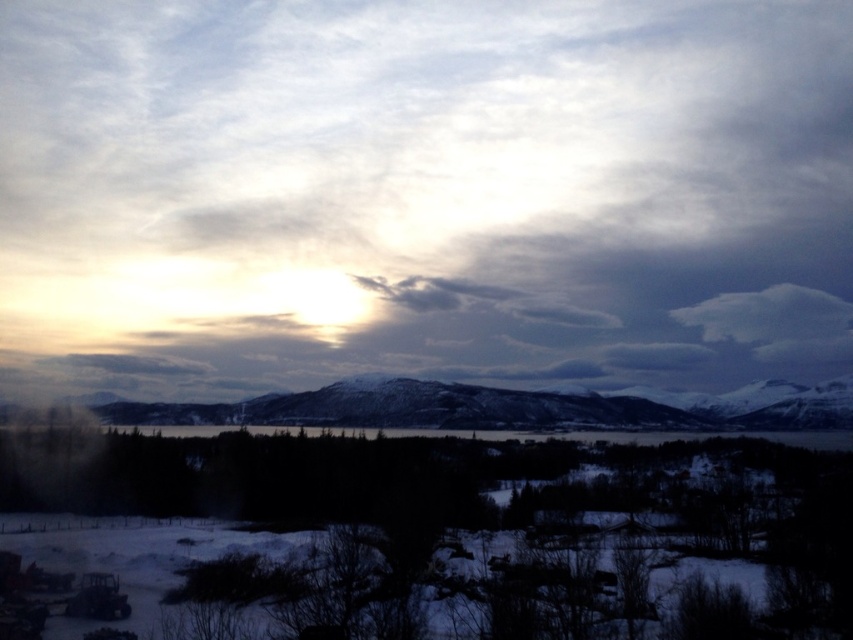
Question: Can you confirm if white fluffy cloud at upper center is positioned to the left of snowy rock formation at center?

Choices:
 (A) no
 (B) yes

Answer: (B)

Question: Which object is closer to the camera taking this photo?

Choices:
 (A) white fluffy cloud at upper center
 (B) snowy rock formation at center

Answer: (B)

Question: Is white fluffy cloud at upper center further to camera compared to snowy rock formation at center?

Choices:
 (A) yes
 (B) no

Answer: (A)

Question: Which of the following is the closest to the observer?

Choices:
 (A) white fluffy cloud at upper center
 (B) snowy rock formation at center

Answer: (B)

Question: Which object is farther from the camera taking this photo?

Choices:
 (A) white fluffy cloud at upper center
 (B) snowy rock formation at center

Answer: (A)

Question: Can you confirm if white fluffy cloud at upper center is smaller than snowy rock formation at center?

Choices:
 (A) no
 (B) yes

Answer: (A)